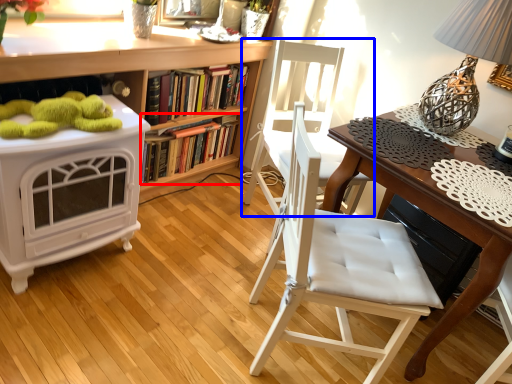
Question: Which object is closer to the camera taking this photo, book (highlighted by a red box) or chair (highlighted by a blue box)?

Choices:
 (A) book
 (B) chair

Answer: (B)